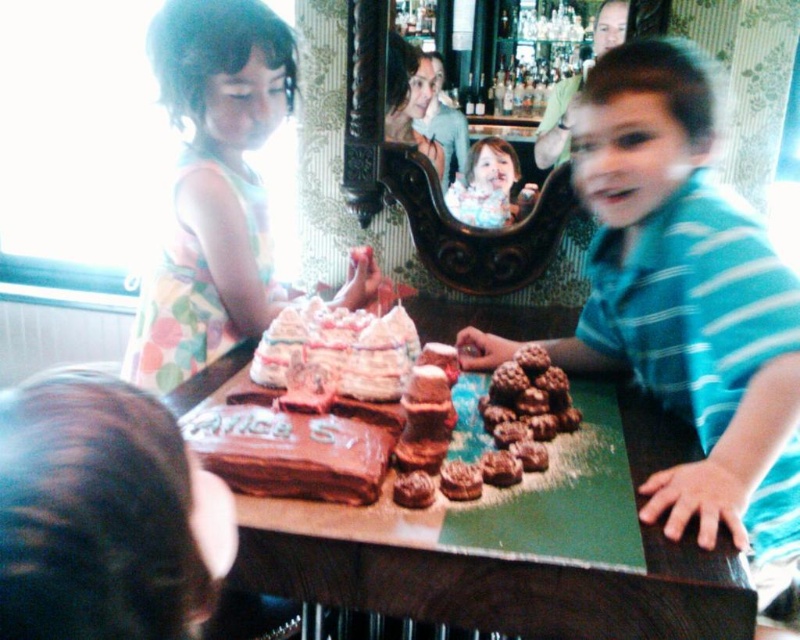
Does matte brown cookies at right have a smaller size compared to brown cardboard table at center?

No, matte brown cookies at right is not smaller than brown cardboard table at center.

Is matte brown cookies at right positioned in front of brown cardboard table at center?

Yes.

At what (x,y) coordinates should I click in order to perform the action: click on matte brown cookies at right. Please return your answer as a coordinate pair (x, y). This screenshot has height=640, width=800. Looking at the image, I should click on (690, 305).

Is brown cardboard table at center in front of pastel floral dress at left?

Yes, brown cardboard table at center is closer to the viewer.

Does point (498, 593) come behind point (180, 200)?

No.

This screenshot has height=640, width=800. What are the coordinates of `brown cardboard table at center` in the screenshot? It's located at tap(532, 561).

Between point (486, 202) and point (480, 472), which one is positioned in front?

Point (480, 472) is in front.

Is point (500, 145) less distant than point (466, 465)?

No, it is behind (466, 465).

At what (x,y) coordinates should I click in order to perform the action: click on smooth cream dress at upper left. Please return your answer as a coordinate pair (x, y). The height and width of the screenshot is (640, 800). Looking at the image, I should click on (490, 186).